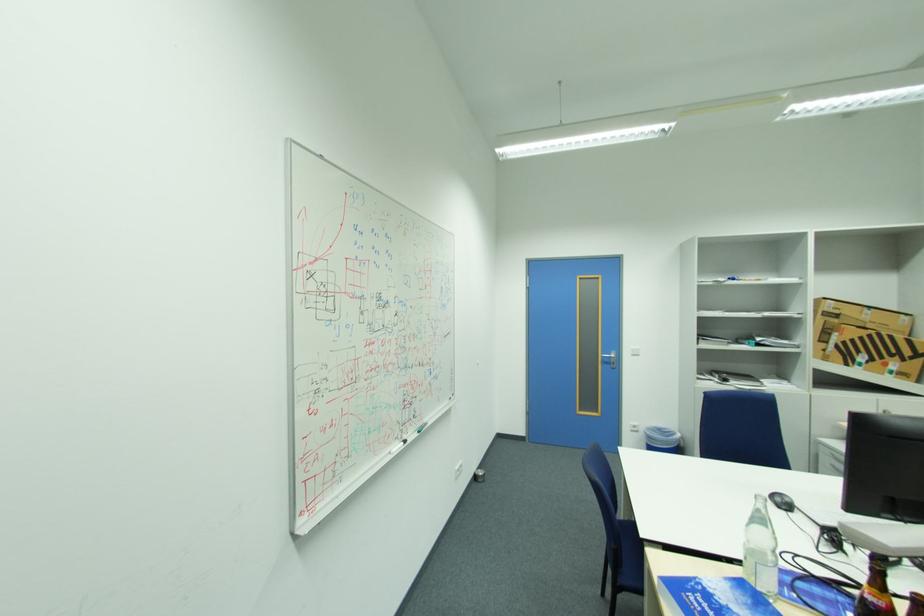
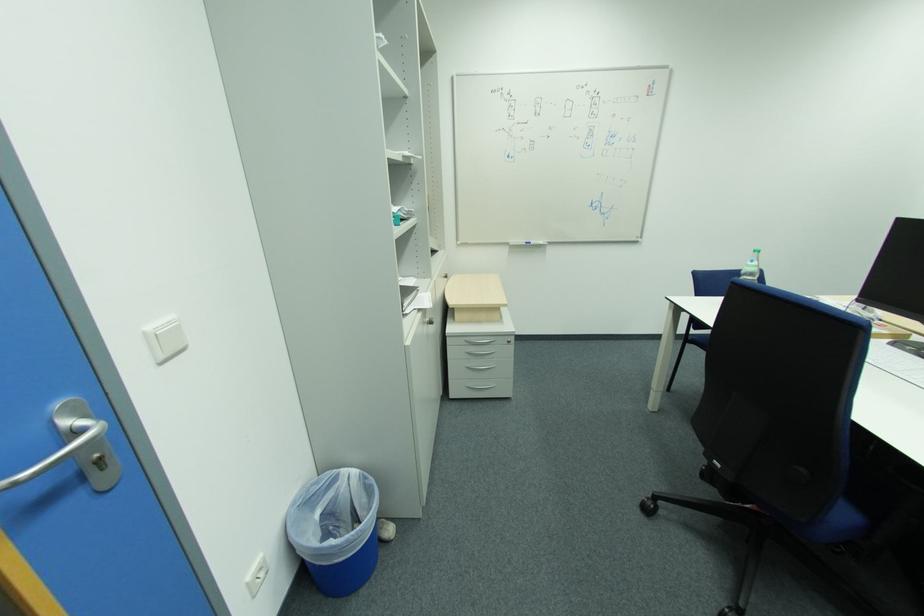
Locate, in the second image, the point that corresponds to the point at 664,431 in the first image.

(304, 507)